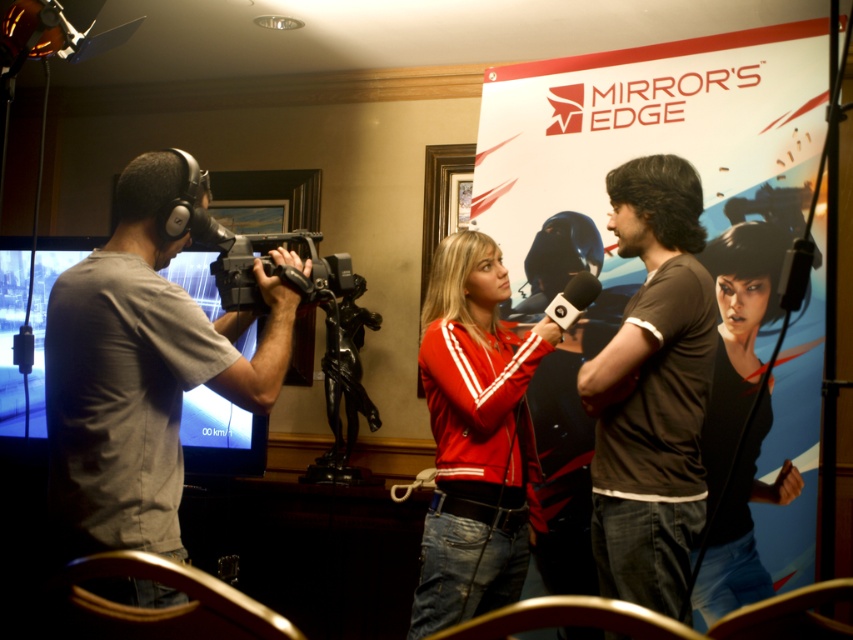
You are organizing a photoshoot and need to determine which clothing item takes up more visual space in the image. Based on the scene description, which item is larger between the gray fabric shirt at left and the black matte jacket at center?

The gray fabric shirt at left is larger than the black matte jacket at center according to the description.

You are a photographer positioned in the room and want to take a photo that includes both the gray fabric shirt at left and the black matte jacket at center. Which object should you focus on first to ensure both are in sharp focus?

The gray fabric shirt at left is closer to the viewer than the black matte jacket at center. To ensure both are in sharp focus, you should focus on the gray fabric shirt at left first, as it is the closer object, and adjust the depth of field accordingly.